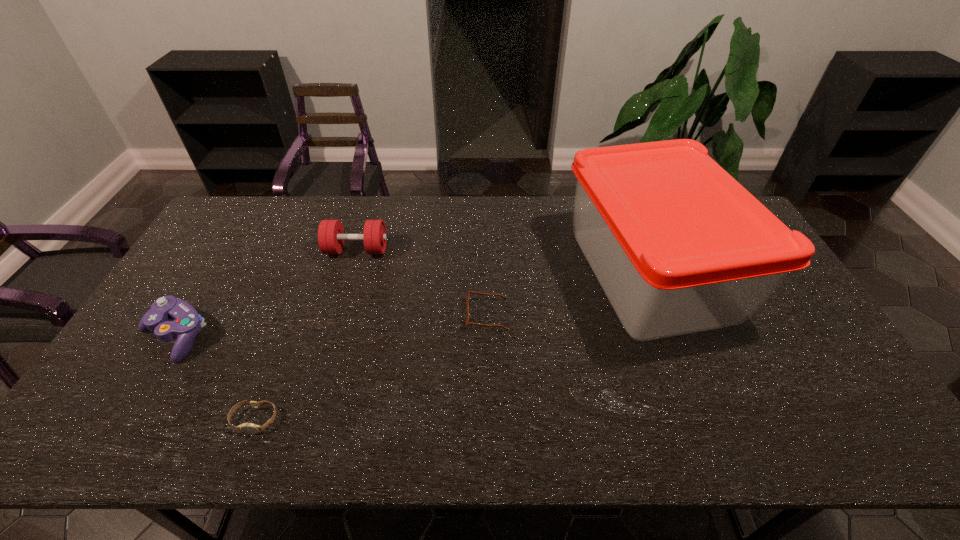
The width and height of the screenshot is (960, 540). Identify the location of vacant space at the left edge of the desktop. (119, 378).

Locate an element on the screen. free region at the right edge of the desktop is located at coordinates (777, 342).

The image size is (960, 540). In order to click on unoccupied area between the tallest object and the spectacles in this screenshot , I will do `click(569, 294)`.

The height and width of the screenshot is (540, 960). Find the location of `free space between the control and the fourth object from left to right`. free space between the control and the fourth object from left to right is located at coordinates (331, 325).

I want to click on vacant space that is in between the nearest object and the spectacles, so click(372, 367).

Find the location of `vacant area that lies between the watch and the fourth shortest object`. vacant area that lies between the watch and the fourth shortest object is located at coordinates (306, 335).

Where is `free space between the dumbbell and the spectacles`? free space between the dumbbell and the spectacles is located at coordinates (421, 282).

This screenshot has width=960, height=540. Identify the location of free point between the fourth shortest object and the spectacles. (421, 282).

Find the location of a particular element. Image resolution: width=960 pixels, height=540 pixels. free space between the fourth object from left to right and the rightmost object is located at coordinates (569, 294).

Image resolution: width=960 pixels, height=540 pixels. What are the coordinates of `free point between the tray and the watch` in the screenshot? It's located at (453, 347).